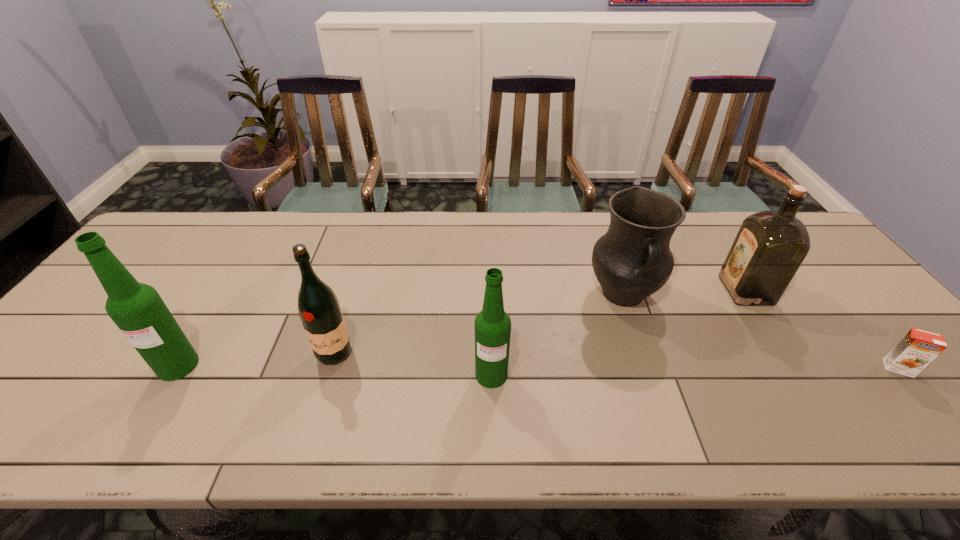
Locate an element on the screen. This screenshot has height=540, width=960. the taller beer bottle is located at coordinates (137, 309).

What are the coordinates of `the left beer bottle` in the screenshot? It's located at (137, 309).

Image resolution: width=960 pixels, height=540 pixels. Find the location of `the right beer bottle`. the right beer bottle is located at coordinates (492, 325).

Where is `the fourth object from right to left`? Image resolution: width=960 pixels, height=540 pixels. the fourth object from right to left is located at coordinates (492, 325).

Where is `pitcher`? This screenshot has height=540, width=960. pitcher is located at coordinates (632, 260).

The width and height of the screenshot is (960, 540). Find the location of `the fifth object from left to right`. the fifth object from left to right is located at coordinates (770, 246).

Identify the location of the farther liquor. (770, 246).

Where is `the fifth object from right to left`? The image size is (960, 540). the fifth object from right to left is located at coordinates (318, 306).

Find the location of `the nearer liquor`. the nearer liquor is located at coordinates (318, 306).

The height and width of the screenshot is (540, 960). Identify the location of the shortest object. (917, 349).